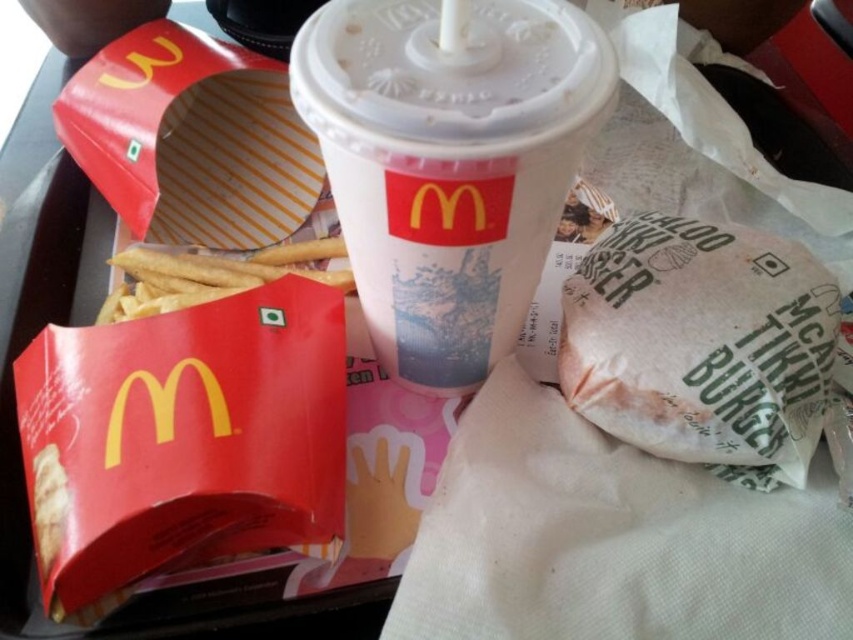
Question: Which point appears farthest from the camera in this image?

Choices:
 (A) (669, 232)
 (B) (386, 365)

Answer: (B)

Question: Is white paper cup at center positioned in front of white paper burger at lower right?

Choices:
 (A) yes
 (B) no

Answer: (A)

Question: Is white paper cup at center closer to camera compared to white paper burger at lower right?

Choices:
 (A) no
 (B) yes

Answer: (B)

Question: Which of the following is the farthest from the observer?

Choices:
 (A) (648, 436)
 (B) (384, 161)

Answer: (A)

Question: Does white paper cup at center have a lesser width compared to white paper burger at lower right?

Choices:
 (A) yes
 (B) no

Answer: (A)